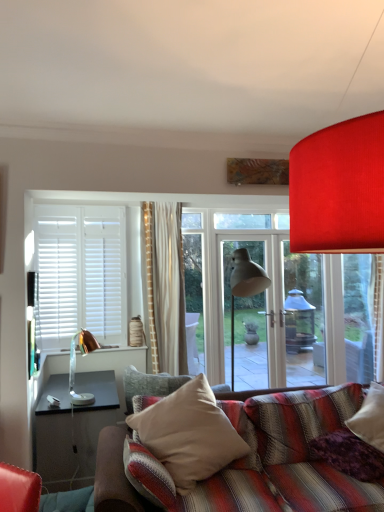
Question: Is beige fabric pillow at center, which is the 1th pillow in left-to-right order, at the right side of purple soft pillow at lower right, the second pillow from the left?

Choices:
 (A) no
 (B) yes

Answer: (A)

Question: Is the depth of beige fabric pillow at center, which is the 1th pillow in left-to-right order, greater than that of purple soft pillow at lower right, which appears as the first pillow when viewed from the right?

Choices:
 (A) yes
 (B) no

Answer: (B)

Question: Does beige fabric pillow at center, marked as the 2th pillow in a right-to-left arrangement, lie in front of purple soft pillow at lower right, which appears as the first pillow when viewed from the right?

Choices:
 (A) yes
 (B) no

Answer: (A)

Question: Is beige fabric pillow at center, which is the 1th pillow in left-to-right order, not inside purple soft pillow at lower right, which appears as the first pillow when viewed from the right?

Choices:
 (A) no
 (B) yes

Answer: (B)

Question: From the image's perspective, is beige fabric pillow at center, marked as the 2th pillow in a right-to-left arrangement, on top of purple soft pillow at lower right, which appears as the first pillow when viewed from the right?

Choices:
 (A) no
 (B) yes

Answer: (B)

Question: Considering the relative sizes of beige fabric pillow at center, marked as the 2th pillow in a right-to-left arrangement, and purple soft pillow at lower right, the second pillow from the left, in the image provided, is beige fabric pillow at center, marked as the 2th pillow in a right-to-left arrangement, wider than purple soft pillow at lower right, the second pillow from the left,?

Choices:
 (A) yes
 (B) no

Answer: (A)

Question: Is purple soft pillow at lower right, the second pillow from the left, facing away from copper metallic table lamp at left?

Choices:
 (A) no
 (B) yes

Answer: (A)

Question: Can you confirm if purple soft pillow at lower right, the second pillow from the left, is positioned to the left of copper metallic table lamp at left?

Choices:
 (A) yes
 (B) no

Answer: (B)

Question: From a real-world perspective, is purple soft pillow at lower right, the second pillow from the left, positioned over copper metallic table lamp at left based on gravity?

Choices:
 (A) no
 (B) yes

Answer: (A)

Question: From a real-world perspective, is purple soft pillow at lower right, which appears as the first pillow when viewed from the right, located beneath copper metallic table lamp at left?

Choices:
 (A) no
 (B) yes

Answer: (B)

Question: Is purple soft pillow at lower right, which appears as the first pillow when viewed from the right, closer to the viewer compared to copper metallic table lamp at left?

Choices:
 (A) yes
 (B) no

Answer: (A)

Question: Is purple soft pillow at lower right, which appears as the first pillow when viewed from the right, smaller than copper metallic table lamp at left?

Choices:
 (A) yes
 (B) no

Answer: (B)

Question: From the image's perspective, does purple soft pillow at lower right, the second pillow from the left, appear higher than beige fabric pillow at center, marked as the 2th pillow in a right-to-left arrangement?

Choices:
 (A) no
 (B) yes

Answer: (A)